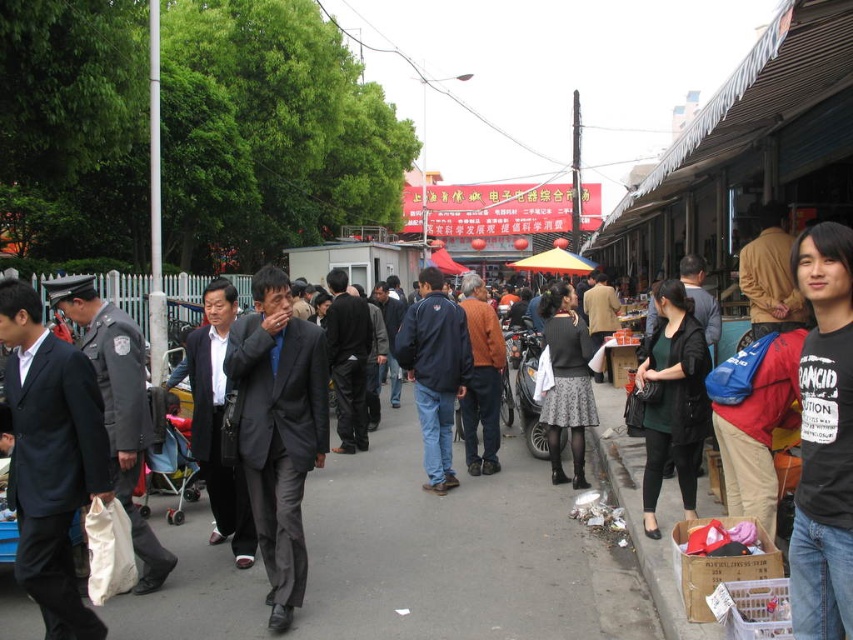
Question: Considering the relative positions of black fabric pavement at center and matte black suit at left in the image provided, where is black fabric pavement at center located with respect to matte black suit at left?

Choices:
 (A) below
 (B) above

Answer: (A)

Question: Considering the real-world distances, which object is closest to the dark gray textured skirt at center?

Choices:
 (A) dark blue suit at left
 (B) dark blue jacket at center
 (C) orange knit sweater at center
 (D) matte black suit at left

Answer: (C)

Question: Which object is the closest to the dark blue jacket at center?

Choices:
 (A) dark green jersey at center
 (B) black fabric pavement at center
 (C) matte black suit at left
 (D) dark gray textured skirt at center

Answer: (D)

Question: Can you confirm if black fabric pavement at center is thinner than dark blue jacket at center?

Choices:
 (A) no
 (B) yes

Answer: (A)

Question: Which point appears farthest from the camera in this image?

Choices:
 (A) (207, 364)
 (B) (309, 401)

Answer: (A)

Question: Can you confirm if dark gray suit at center is wider than matte black suit at left?

Choices:
 (A) no
 (B) yes

Answer: (A)